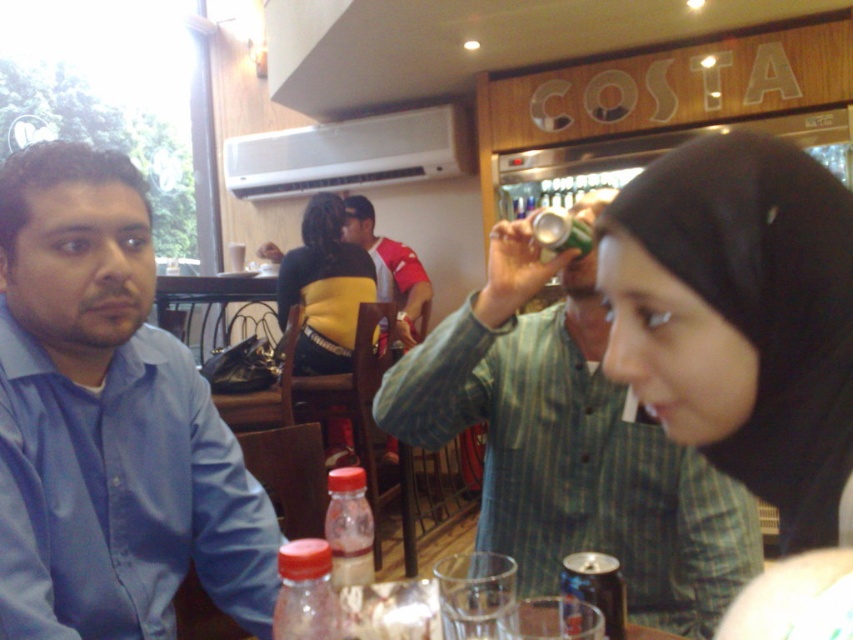
Question: Which object is farther from the camera taking this photo?

Choices:
 (A) blue satin shirt at left
 (B) matte green shirt at center
 (C) red shirt at center
 (D) translucent plastic bottle at center

Answer: (C)

Question: In this image, where is green matte can at upper center located relative to translucent plastic bottle at center?

Choices:
 (A) right
 (B) left

Answer: (A)

Question: From the image, what is the correct spatial relationship of translucent plastic bottle at center in relation to metallic can at upper center?

Choices:
 (A) below
 (B) above

Answer: (A)

Question: Does red shirt at center come in front of translucent plastic bottle at lower left?

Choices:
 (A) yes
 (B) no

Answer: (B)

Question: Among these points, which one is nearest to the camera?

Choices:
 (A) (618, 481)
 (B) (784, 480)
 (C) (355, 524)
 (D) (614, 573)

Answer: (B)

Question: Which point is closer to the camera?

Choices:
 (A) translucent plastic bottle at lower left
 (B) red shirt at center
 (C) metallic can at upper center

Answer: (A)